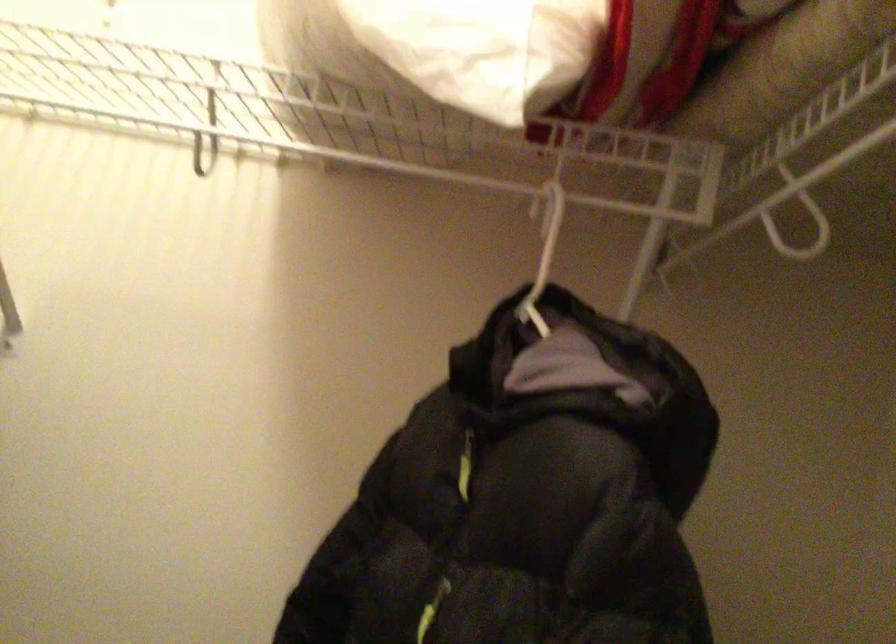
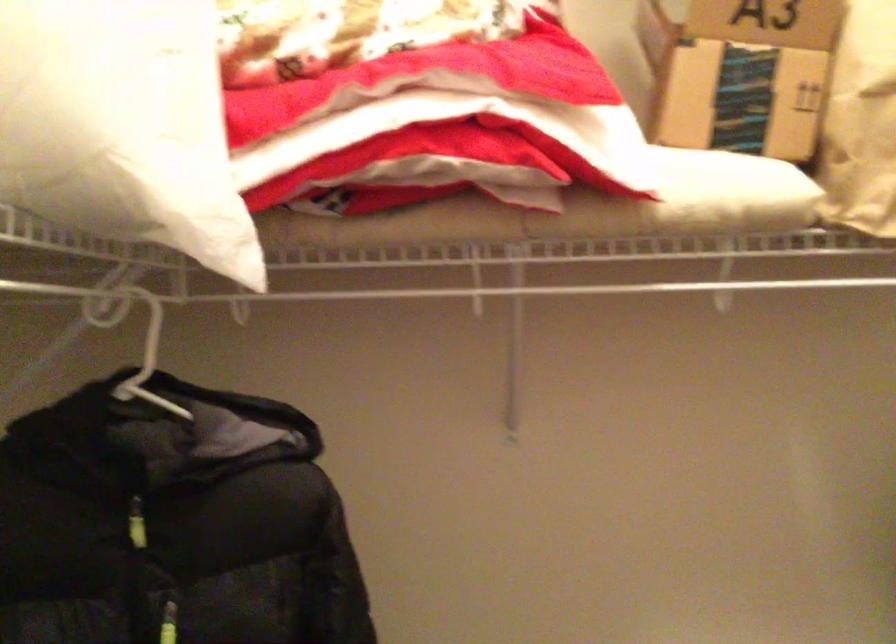
The point at [470,471] is marked in the first image. Where is the corresponding point in the second image?

(136, 524)